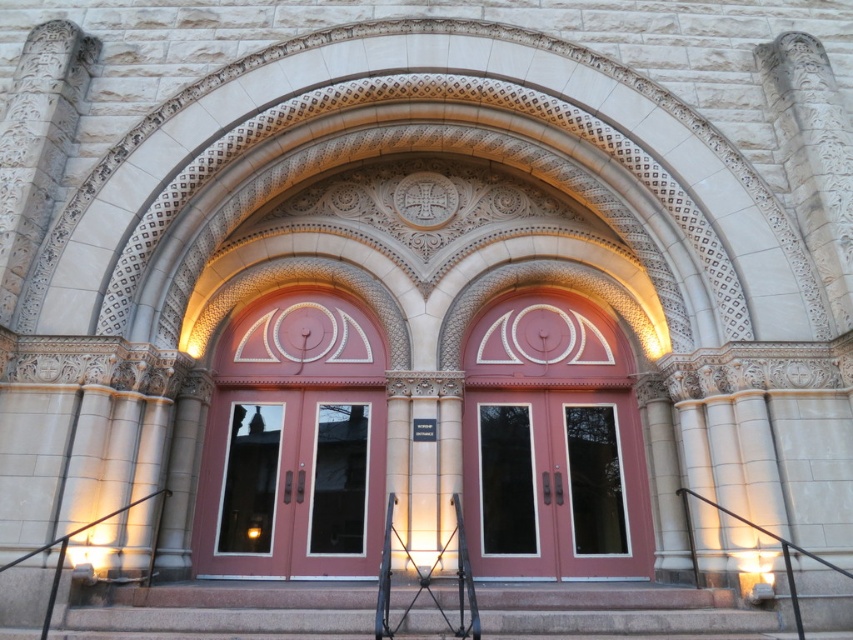
Question: Which point is closer to the camera?

Choices:
 (A) (679, 589)
 (B) (519, 474)
 (C) (242, 428)

Answer: (A)

Question: Does matte glass doors at center come behind granite steps at center?

Choices:
 (A) yes
 (B) no

Answer: (A)

Question: Is matte glass doors at center positioned behind granite steps at center?

Choices:
 (A) yes
 (B) no

Answer: (A)

Question: Which of these objects is positioned farthest from the matte wood doors at center?

Choices:
 (A) granite steps at center
 (B) matte glass doors at center

Answer: (B)

Question: Can you confirm if matte glass doors at center is smaller than granite steps at center?

Choices:
 (A) no
 (B) yes

Answer: (B)

Question: Which of the following is the closest to the observer?

Choices:
 (A) granite steps at center
 (B) matte glass doors at center
 (C) matte wood doors at center

Answer: (A)